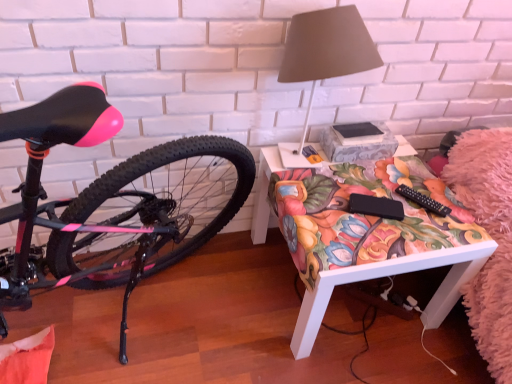
Question: From the image's perspective, relative to floral fabric desk at center, is matte gray lampshade at upper right above or below?

Choices:
 (A) below
 (B) above

Answer: (B)

Question: Looking at their shapes, would you say matte gray lampshade at upper right is wider or thinner than floral fabric desk at center?

Choices:
 (A) thin
 (B) wide

Answer: (A)

Question: Which is farther from the floral fabric desk at center?

Choices:
 (A) black plastic remote control at lower right
 (B) matte gray lampshade at upper right

Answer: (B)

Question: Which is farther from the black plastic remote control at lower right?

Choices:
 (A) floral fabric desk at center
 (B) matte gray lampshade at upper right

Answer: (B)